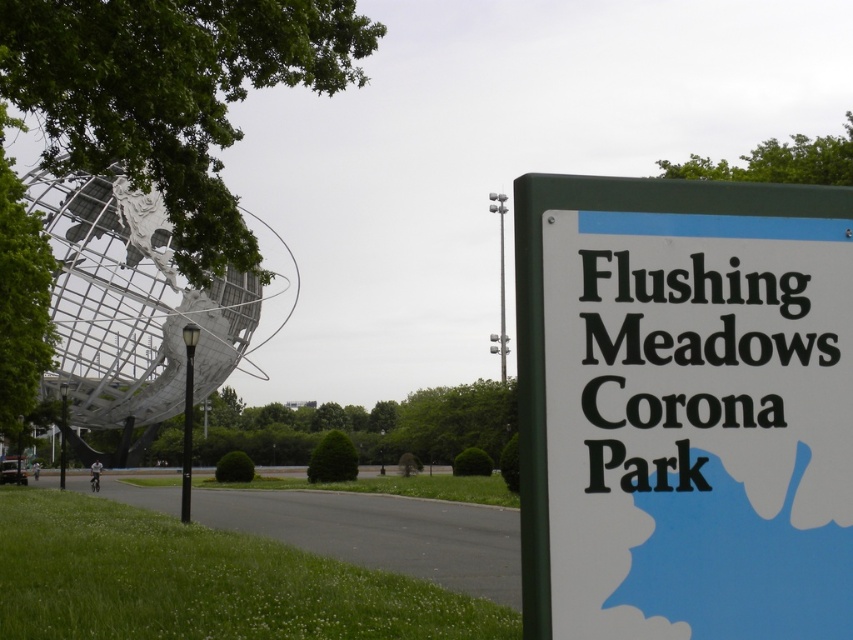
Question: Is white plastic sign at right to the left of metallic globe at left from the viewer's perspective?

Choices:
 (A) no
 (B) yes

Answer: (A)

Question: Considering the relative positions of white plastic sign at right and metallic globe at left in the image provided, where is white plastic sign at right located with respect to metallic globe at left?

Choices:
 (A) left
 (B) right

Answer: (B)

Question: Which point is farther to the camera?

Choices:
 (A) metallic globe at left
 (B) white plastic sign at right

Answer: (A)

Question: Which point appears farthest from the camera in this image?

Choices:
 (A) (705, 381)
 (B) (44, 387)

Answer: (B)

Question: Is white plastic sign at right positioned before metallic globe at left?

Choices:
 (A) yes
 (B) no

Answer: (A)

Question: Which point is farther from the camera taking this photo?

Choices:
 (A) (643, 198)
 (B) (223, 349)

Answer: (B)